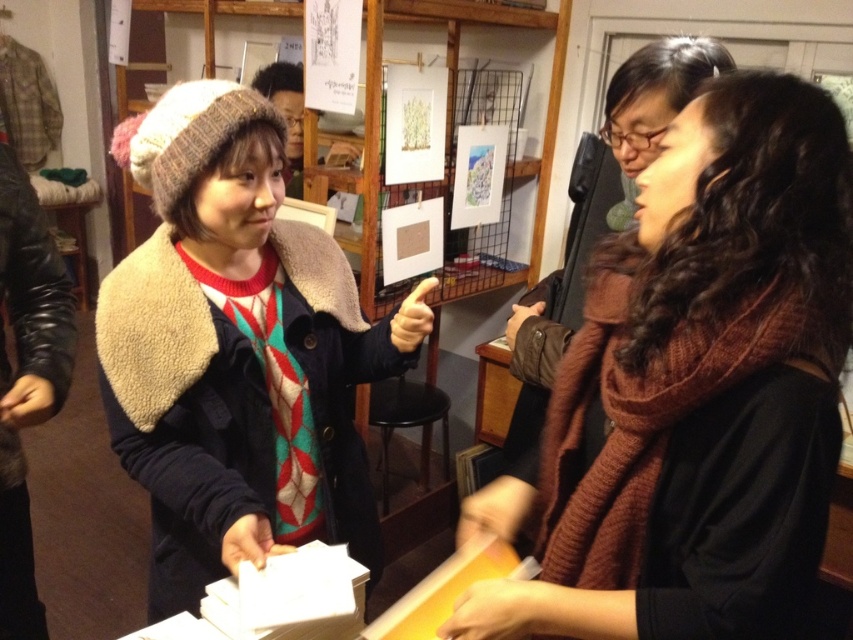
Question: Which of the following is the farthest from the observer?

Choices:
 (A) brown knitted scarf at center
 (B) knitted woolen hat at upper left

Answer: (B)

Question: Which object appears closest to the camera in this image?

Choices:
 (A) knitted woolen hat at upper left
 (B) wooden table at center

Answer: (A)

Question: Is brown knitted scarf at center bigger than wooden table at center?

Choices:
 (A) no
 (B) yes

Answer: (B)

Question: Is brown knitted scarf at center to the right of knitted woolen hat at upper left from the viewer's perspective?

Choices:
 (A) no
 (B) yes

Answer: (B)

Question: Which object is the closest to the brown knitted scarf at center?

Choices:
 (A) wooden table at center
 (B) knitted woolen hat at upper left

Answer: (B)

Question: Considering the relative positions of knitted woolen hat at upper left and wooden table at center in the image provided, where is knitted woolen hat at upper left located with respect to wooden table at center?

Choices:
 (A) below
 (B) above

Answer: (B)